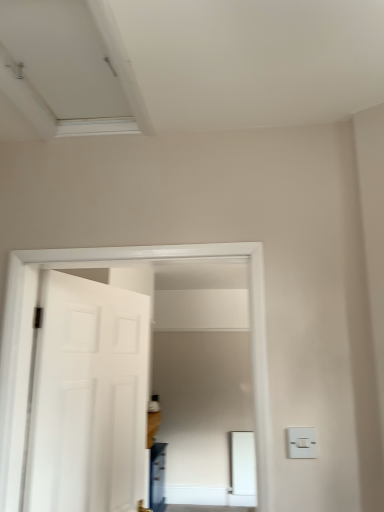
Question: Should I look upward or downward to see white matte exhaust hood at upper left?

Choices:
 (A) down
 (B) up

Answer: (B)

Question: From a real-world perspective, is white matte exhaust hood at upper left physically below white plastic light switch at lower right?

Choices:
 (A) no
 (B) yes

Answer: (A)

Question: Is white matte exhaust hood at upper left facing away from white plastic light switch at lower right?

Choices:
 (A) no
 (B) yes

Answer: (A)

Question: Is white matte exhaust hood at upper left facing towards white plastic light switch at lower right?

Choices:
 (A) no
 (B) yes

Answer: (A)

Question: Considering the relative sizes of white matte exhaust hood at upper left and white plastic light switch at lower right in the image provided, is white matte exhaust hood at upper left bigger than white plastic light switch at lower right?

Choices:
 (A) no
 (B) yes

Answer: (B)

Question: Can we say white matte exhaust hood at upper left lies outside white plastic light switch at lower right?

Choices:
 (A) yes
 (B) no

Answer: (A)

Question: Does white matte exhaust hood at upper left lie behind white plastic light switch at lower right?

Choices:
 (A) yes
 (B) no

Answer: (B)

Question: Considering the relative sizes of white matte door at left and white matte exhaust hood at upper left in the image provided, is white matte door at left shorter than white matte exhaust hood at upper left?

Choices:
 (A) yes
 (B) no

Answer: (B)

Question: Is white matte door at left further to camera compared to white matte exhaust hood at upper left?

Choices:
 (A) no
 (B) yes

Answer: (B)

Question: Can you confirm if white matte door at left is thinner than white matte exhaust hood at upper left?

Choices:
 (A) yes
 (B) no

Answer: (A)

Question: Does white matte door at left have a larger size compared to white matte exhaust hood at upper left?

Choices:
 (A) no
 (B) yes

Answer: (B)

Question: Does white matte door at left have a greater height compared to white matte exhaust hood at upper left?

Choices:
 (A) no
 (B) yes

Answer: (B)

Question: From a real-world perspective, is white matte door at left over white matte exhaust hood at upper left?

Choices:
 (A) yes
 (B) no

Answer: (B)

Question: Is white plastic light switch at lower right shorter than white matte door at left?

Choices:
 (A) no
 (B) yes

Answer: (B)